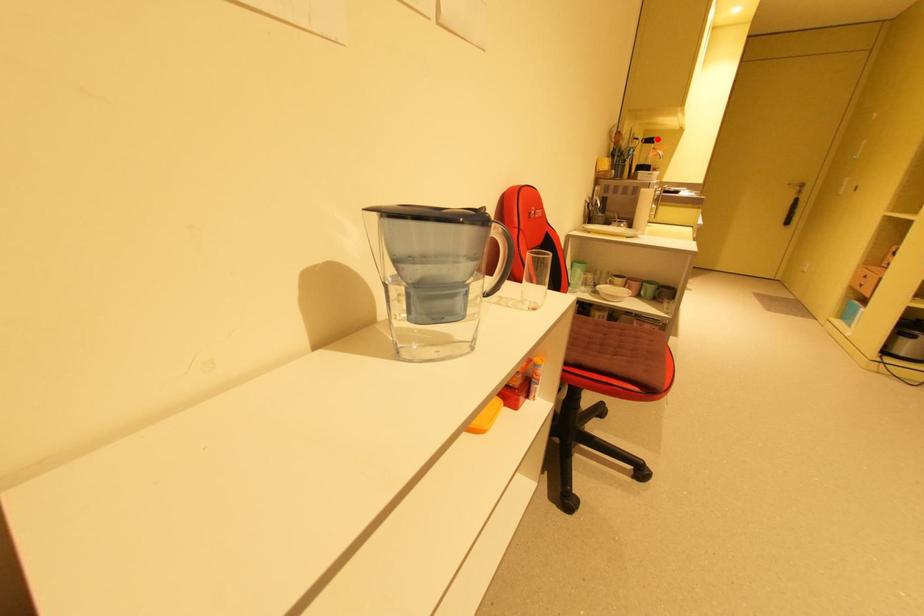
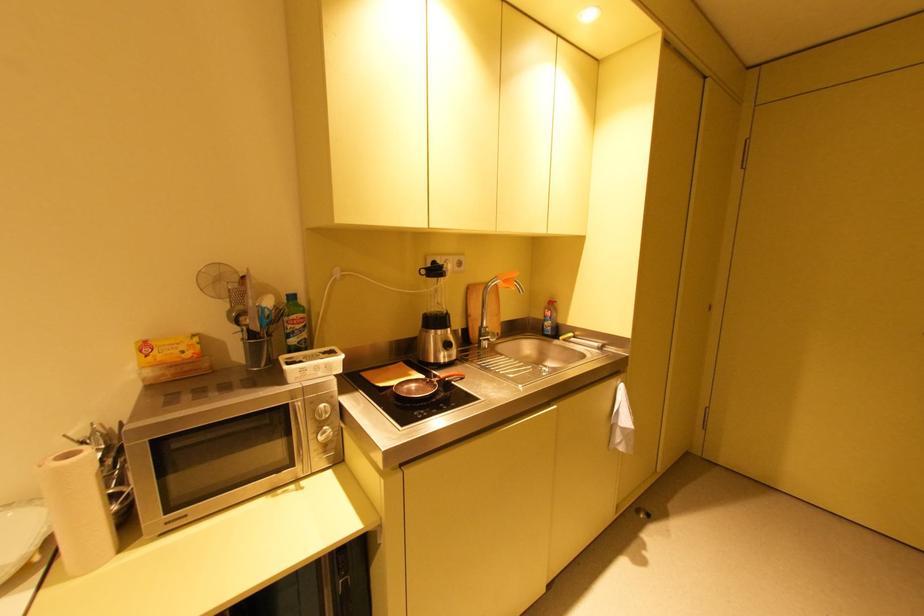
Question: A red point is marked in image1. In image2, is the corresponding 3D point closer to the camera or farther? Reply with the corresponding letter.

Choices:
 (A) The corresponding 3D point is closer.
 (B) The corresponding 3D point is farther.

Answer: (B)